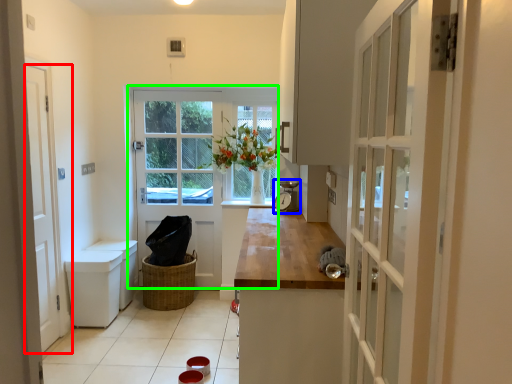
Question: Which object is positioned closest to door (highlighted by a red box)? Select from appliance (highlighted by a blue box) and door (highlighted by a green box).

Choices:
 (A) appliance
 (B) door

Answer: (B)